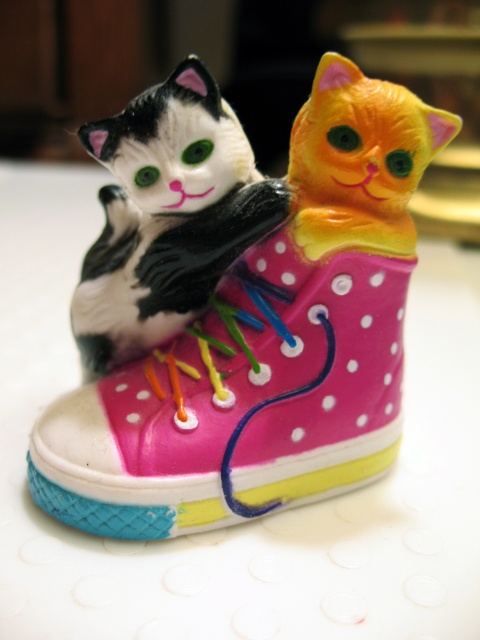
Question: Does pink polka dot shoe at center come in front of matte black cat at center?

Choices:
 (A) yes
 (B) no

Answer: (B)

Question: Observing the image, what is the correct spatial positioning of pink polka dot shoe at center in reference to matte black cat at center?

Choices:
 (A) left
 (B) right

Answer: (B)

Question: Is pink polka dot shoe at center in front of matte black cat at center?

Choices:
 (A) no
 (B) yes

Answer: (A)

Question: Which object appears closest to the camera in this image?

Choices:
 (A) matte black cat at center
 (B) pink polka dot shoe at center

Answer: (A)